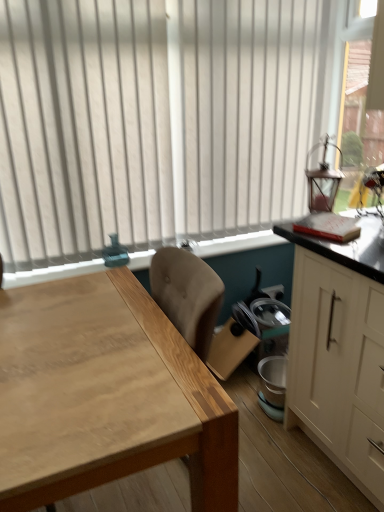
Question: From a real-world perspective, is clear glass lantern at upper right positioned under white vertical blinds at upper center based on gravity?

Choices:
 (A) yes
 (B) no

Answer: (B)

Question: Is clear glass lantern at upper right beside white vertical blinds at upper center?

Choices:
 (A) yes
 (B) no

Answer: (B)

Question: From the image's perspective, does clear glass lantern at upper right appear lower than white vertical blinds at upper center?

Choices:
 (A) yes
 (B) no

Answer: (B)

Question: From a real-world perspective, is clear glass lantern at upper right positioned over white vertical blinds at upper center based on gravity?

Choices:
 (A) yes
 (B) no

Answer: (A)

Question: Is white vertical blinds at upper center at the back of clear glass lantern at upper right?

Choices:
 (A) yes
 (B) no

Answer: (B)

Question: Can you confirm if clear glass lantern at upper right is positioned to the left of white vertical blinds at upper center?

Choices:
 (A) no
 (B) yes

Answer: (A)

Question: Is natural wood table at center a part of white matte cabinet at right?

Choices:
 (A) no
 (B) yes

Answer: (A)

Question: Is natural wood table at center at the back of white matte cabinet at right?

Choices:
 (A) no
 (B) yes

Answer: (A)

Question: Is white matte cabinet at right at the left side of natural wood table at center?

Choices:
 (A) yes
 (B) no

Answer: (B)

Question: From the image's perspective, is white matte cabinet at right below natural wood table at center?

Choices:
 (A) no
 (B) yes

Answer: (A)

Question: Is white matte cabinet at right thinner than natural wood table at center?

Choices:
 (A) yes
 (B) no

Answer: (A)

Question: Is white matte cabinet at right oriented towards natural wood table at center?

Choices:
 (A) no
 (B) yes

Answer: (B)

Question: Is white matte cabinet at right smaller than white vertical blinds at upper center?

Choices:
 (A) no
 (B) yes

Answer: (A)